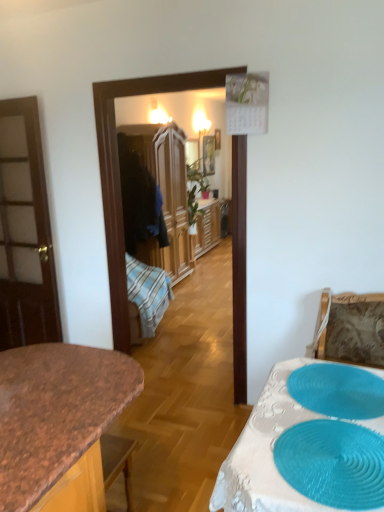
Find the location of a particular element. free space to the back side of teal rubber placemat at lower right, arranged as the 2th oval when viewed from the back is located at coordinates (311, 400).